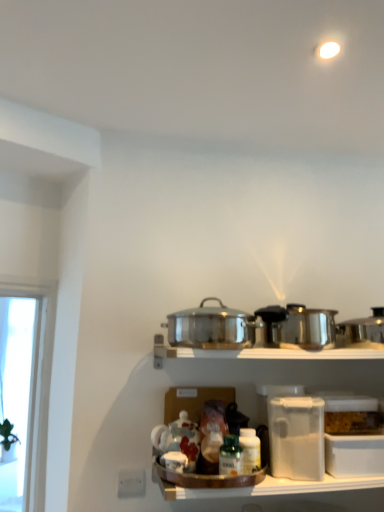
Question: Could you tell me if polished stainless steel pot at center, the first crock pot from the left, is facing clear plastic container at lower right?

Choices:
 (A) no
 (B) yes

Answer: (A)

Question: Is polished stainless steel pot at center, the first crock pot from the left, positioned far away from clear plastic container at lower right?

Choices:
 (A) yes
 (B) no

Answer: (B)

Question: From a real-world perspective, is polished stainless steel pot at center, the second crock pot from the right, located higher than clear plastic container at lower right?

Choices:
 (A) no
 (B) yes

Answer: (B)

Question: Is clear plastic container at lower right located within polished stainless steel pot at center, the second crock pot from the right?

Choices:
 (A) yes
 (B) no

Answer: (B)

Question: Does polished stainless steel pot at center, the second crock pot from the right, have a greater height compared to clear plastic container at lower right?

Choices:
 (A) no
 (B) yes

Answer: (A)

Question: Is polished stainless steel pot at center, the second crock pot from the right, to the left of clear plastic container at lower right from the viewer's perspective?

Choices:
 (A) yes
 (B) no

Answer: (A)

Question: Is clear plastic container at lower right surrounding polished stainless steel pot at center, the first crock pot from the left?

Choices:
 (A) no
 (B) yes

Answer: (A)

Question: Does clear plastic container at lower right appear on the left side of polished stainless steel pot at center, the second crock pot from the right?

Choices:
 (A) no
 (B) yes

Answer: (A)

Question: Can you confirm if clear plastic container at lower right is bigger than polished stainless steel pot at center, the first crock pot from the left?

Choices:
 (A) no
 (B) yes

Answer: (A)

Question: From a real-world perspective, is clear plastic container at lower right on top of polished stainless steel pot at center, the first crock pot from the left?

Choices:
 (A) yes
 (B) no

Answer: (B)

Question: Can you confirm if clear plastic container at lower right is wider than polished stainless steel pot at center, the first crock pot from the left?

Choices:
 (A) no
 (B) yes

Answer: (A)

Question: Is clear plastic container at lower right shorter than polished stainless steel pot at center, the first crock pot from the left?

Choices:
 (A) yes
 (B) no

Answer: (B)

Question: Considering the relative positions of shiny metallic crock pot at right, which ranks as the 1th crock pot in right-to-left order, and clear plastic container at lower right in the image provided, is shiny metallic crock pot at right, which ranks as the 1th crock pot in right-to-left order, to the right of clear plastic container at lower right from the viewer's perspective?

Choices:
 (A) yes
 (B) no

Answer: (A)